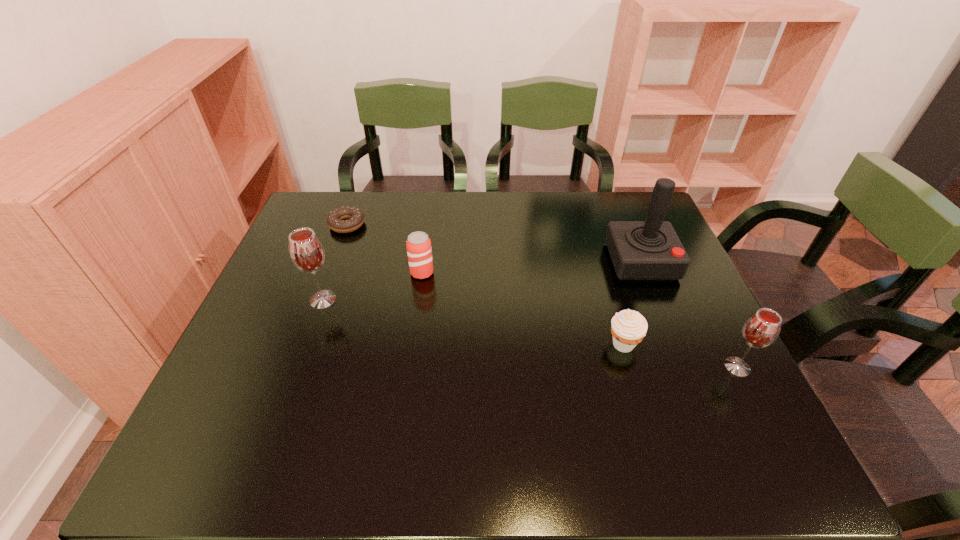
You are a GUI agent. You are given a task and a screenshot of the screen. Output one action in this format:
    pyautogui.click(x=<x>, y=<y>)
    Task: Click on the farther wineglass
    This screenshot has width=960, height=540.
    Given the screenshot: What is the action you would take?
    pyautogui.click(x=306, y=251)

Locate an element on the screen. This screenshot has width=960, height=540. the third nearest object is located at coordinates (306, 251).

Where is `the right wineglass`? This screenshot has width=960, height=540. the right wineglass is located at coordinates (762, 328).

Where is `the shorter wineglass`? the shorter wineglass is located at coordinates (762, 328).

Locate an element on the screen. the tallest object is located at coordinates (640, 250).

Locate an element on the screen. the farthest object is located at coordinates (335, 220).

The height and width of the screenshot is (540, 960). I want to click on the shortest object, so click(x=335, y=220).

Image resolution: width=960 pixels, height=540 pixels. In order to click on beer can in this screenshot , I will do `click(418, 245)`.

You are a GUI agent. You are given a task and a screenshot of the screen. Output one action in this format:
    pyautogui.click(x=<x>, y=<y>)
    Task: Click on the muffin
    
    Given the screenshot: What is the action you would take?
    pyautogui.click(x=628, y=327)

You are a GUI agent. You are given a task and a screenshot of the screen. Output one action in this format:
    pyautogui.click(x=<x>, y=<y>)
    Task: Click on the vacant area situated on the right of the fifth shortest object
    
    Given the screenshot: What is the action you would take?
    pyautogui.click(x=377, y=300)